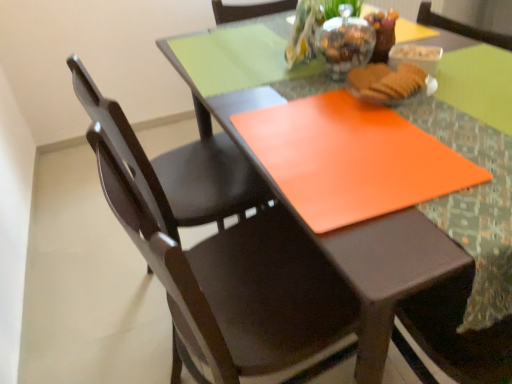
Question: From a real-world perspective, is orange matte placemat at center on orange matte placemat at center?

Choices:
 (A) yes
 (B) no

Answer: (A)

Question: Is orange matte placemat at center placed right next to orange matte placemat at center?

Choices:
 (A) no
 (B) yes

Answer: (B)

Question: Is orange matte placemat at center closer to the viewer compared to orange matte placemat at center?

Choices:
 (A) yes
 (B) no

Answer: (B)

Question: From the image's perspective, does orange matte placemat at center appear higher than orange matte placemat at center?

Choices:
 (A) no
 (B) yes

Answer: (B)

Question: Is orange matte placemat at center thinner than orange matte placemat at center?

Choices:
 (A) yes
 (B) no

Answer: (A)

Question: Is point (352, 82) closer or farther from the camera than point (170, 223)?

Choices:
 (A) closer
 (B) farther

Answer: (A)

Question: From the image's perspective, is matte brown biscuit at center positioned above or below matte dark wood chair at left, placed as the 2th chair when sorted from front to back?

Choices:
 (A) below
 (B) above

Answer: (B)

Question: Is matte brown biscuit at center taller or shorter than matte dark wood chair at left, placed as the 2th chair when sorted from front to back?

Choices:
 (A) short
 (B) tall

Answer: (A)

Question: Is matte brown biscuit at center in front of or behind matte dark wood chair at left, placed as the 2th chair when sorted from front to back, in the image?

Choices:
 (A) behind
 (B) front

Answer: (B)

Question: Is point (359, 215) closer or farther from the camera than point (450, 183)?

Choices:
 (A) closer
 (B) farther

Answer: (A)

Question: Considering the positions of orange matte placemat at center and orange matte placemat at center in the image, is orange matte placemat at center bigger or smaller than orange matte placemat at center?

Choices:
 (A) big
 (B) small

Answer: (B)

Question: From their relative heights in the image, would you say orange matte placemat at center is taller or shorter than orange matte placemat at center?

Choices:
 (A) tall
 (B) short

Answer: (B)

Question: From a real-world perspective, relative to orange matte placemat at center, is orange matte placemat at center vertically above or below?

Choices:
 (A) below
 (B) above

Answer: (B)

Question: From a real-world perspective, is matte dark wood chair at center, placed as the 2th chair when sorted from back to front, above or below orange matte placemat at center?

Choices:
 (A) above
 (B) below

Answer: (B)

Question: Is matte dark wood chair at center, placed as the 2th chair when sorted from back to front, bigger or smaller than orange matte placemat at center?

Choices:
 (A) small
 (B) big

Answer: (B)